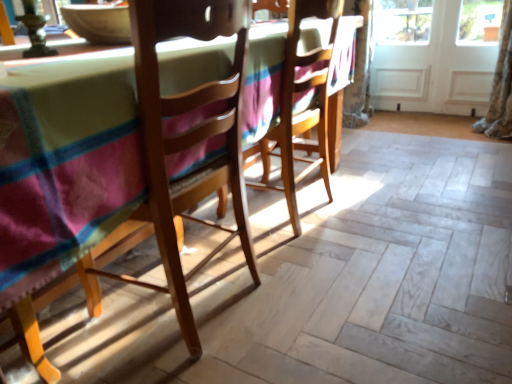
Question: Is wooden chair at left, the second chair viewed from the back, not inside white wood screen door at upper right, which is the 2th screen door from left to right?

Choices:
 (A) yes
 (B) no

Answer: (A)

Question: Does wooden chair at left, acting as the 1th chair starting from the front, have a lesser height compared to white wood screen door at upper right, which is the first screen door in right-to-left order?

Choices:
 (A) no
 (B) yes

Answer: (A)

Question: From the image's perspective, is wooden chair at left, the second chair viewed from the back, above white wood screen door at upper right, which is the 2th screen door from left to right?

Choices:
 (A) no
 (B) yes

Answer: (A)

Question: Is wooden chair at left, acting as the 1th chair starting from the front, positioned behind white wood screen door at upper right, which is the 2th screen door from left to right?

Choices:
 (A) no
 (B) yes

Answer: (A)

Question: Is wooden chair at left, acting as the 1th chair starting from the front, closer to the viewer compared to white wood screen door at upper right, which is the 2th screen door from left to right?

Choices:
 (A) no
 (B) yes

Answer: (B)

Question: From the image's perspective, is wooden chair at left, acting as the 1th chair starting from the front, above or below white wooden screen door at right, arranged as the first screen door when viewed from the left?

Choices:
 (A) below
 (B) above

Answer: (A)

Question: From a real-world perspective, relative to white wooden screen door at right, marked as the second screen door in a right-to-left arrangement, is wooden chair at left, acting as the 1th chair starting from the front, vertically above or below?

Choices:
 (A) below
 (B) above

Answer: (B)

Question: In terms of width, does wooden chair at left, the second chair viewed from the back, look wider or thinner when compared to white wooden screen door at right, arranged as the first screen door when viewed from the left?

Choices:
 (A) thin
 (B) wide

Answer: (B)

Question: Is wooden chair at left, the second chair viewed from the back, inside or outside of white wooden screen door at right, marked as the second screen door in a right-to-left arrangement?

Choices:
 (A) inside
 (B) outside

Answer: (B)

Question: In the image, is white wood screen door at upper right, which is the 2th screen door from left to right, on the left side or the right side of wooden chair at center, the 2th chair when ordered from front to back?

Choices:
 (A) right
 (B) left

Answer: (A)

Question: Is white wood screen door at upper right, which is the 2th screen door from left to right, taller or shorter than wooden chair at center, the first chair from the back?

Choices:
 (A) tall
 (B) short

Answer: (B)

Question: From a real-world perspective, relative to wooden chair at center, the 2th chair when ordered from front to back, is white wood screen door at upper right, which is the first screen door in right-to-left order, vertically above or below?

Choices:
 (A) below
 (B) above

Answer: (A)

Question: Is point (444, 23) closer or farther from the camera than point (306, 62)?

Choices:
 (A) closer
 (B) farther

Answer: (B)

Question: Looking at their shapes, would you say wooden chair at center, the 2th chair when ordered from front to back, is wider or thinner than wooden chair at left, the second chair viewed from the back?

Choices:
 (A) thin
 (B) wide

Answer: (A)

Question: Do you think wooden chair at center, the first chair from the back, is within wooden chair at left, acting as the 1th chair starting from the front, or outside of it?

Choices:
 (A) inside
 (B) outside

Answer: (B)